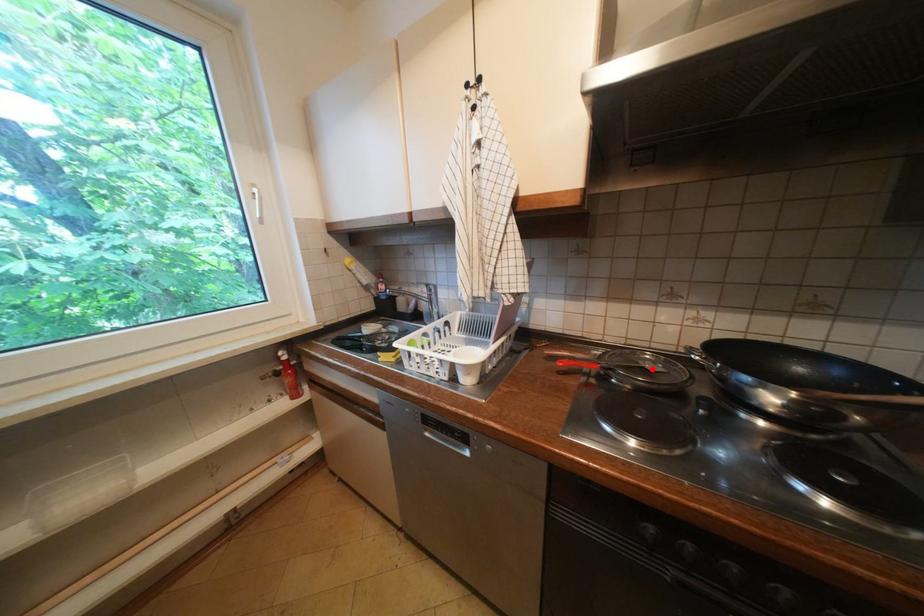
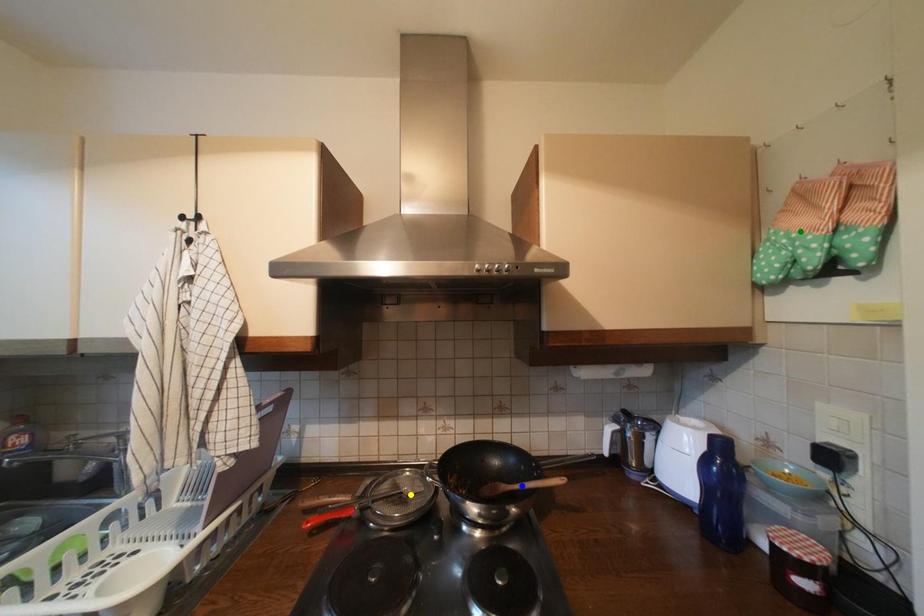
Question: I am providing you with two images of the same scene from different viewpoints. A red point is marked on the first image. You are given multiple points on the second image. In image 2, which mark is for the same physical point as the one in image 1?

Choices:
 (A) green point
 (B) yellow point
 (C) blue point

Answer: (B)